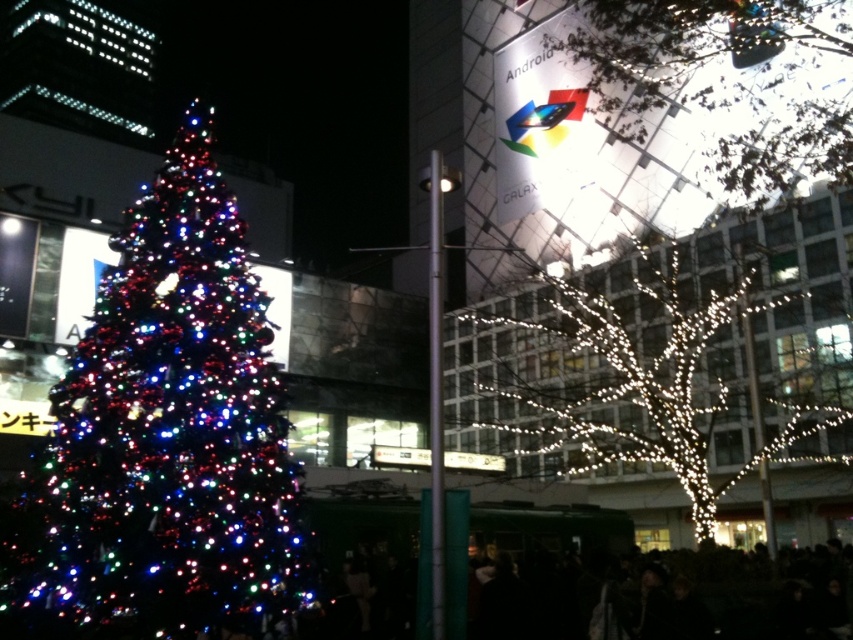
Question: Which object is the farthest from the illuminated wire at upper right?

Choices:
 (A) multicolored lights at left
 (B) illuminated wire at right

Answer: (A)

Question: Among these points, which one is farthest from the camera?

Choices:
 (A) coord(293,512)
 (B) coord(654,304)
 (C) coord(741,42)

Answer: (B)

Question: Which object appears farthest from the camera in this image?

Choices:
 (A) illuminated wire at right
 (B) illuminated wire at upper right
 (C) multicolored lights at left

Answer: (B)

Question: Is multicolored lights at left thinner than illuminated wire at upper right?

Choices:
 (A) yes
 (B) no

Answer: (B)

Question: Is multicolored lights at left in front of illuminated wire at upper right?

Choices:
 (A) yes
 (B) no

Answer: (A)

Question: Does multicolored lights at left have a larger size compared to illuminated wire at upper right?

Choices:
 (A) yes
 (B) no

Answer: (A)